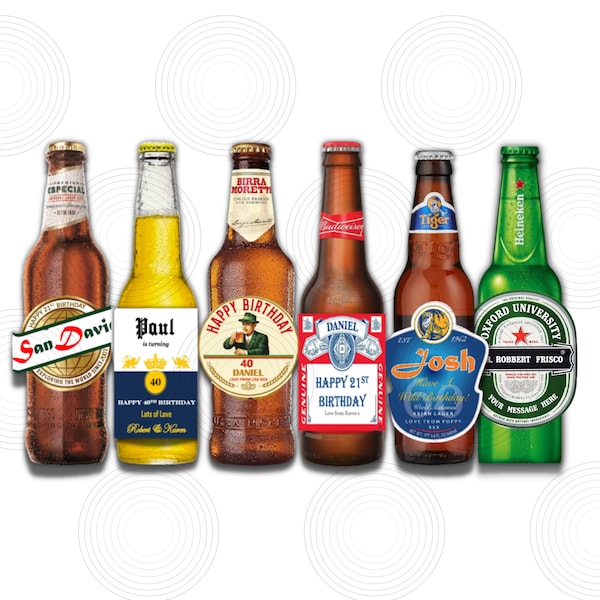
The width and height of the screenshot is (600, 600). Find the location of `beer bottles`. beer bottles is located at coordinates (57, 328), (128, 299), (243, 311), (341, 328), (426, 326), (532, 324).